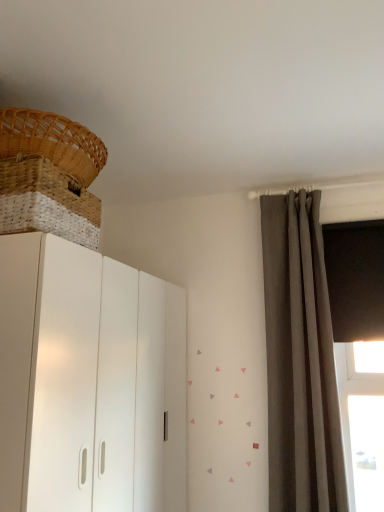
Question: Considering the positions of woven wood basket at upper left, positioned as the 1th basket in top-to-bottom order, and matte gray curtain at right in the image, is woven wood basket at upper left, positioned as the 1th basket in top-to-bottom order, bigger or smaller than matte gray curtain at right?

Choices:
 (A) small
 (B) big

Answer: (A)

Question: From a real-world perspective, is woven wood basket at upper left, positioned as the 1th basket in top-to-bottom order, above or below matte gray curtain at right?

Choices:
 (A) above
 (B) below

Answer: (A)

Question: Which object is positioned farthest from the white matte cupboard at left?

Choices:
 (A) matte gray curtain at right
 (B) woven wood basket at upper left, positioned as the 1th basket in top-to-bottom order
 (C) woven wood basket at upper left, the 2th basket from the top

Answer: (A)

Question: Which object is the closest to the woven wood basket at upper left, marked as the second basket in a bottom-to-top arrangement?

Choices:
 (A) woven wood basket at upper left, which is the first basket in bottom-to-top order
 (B) white matte cupboard at left
 (C) matte gray curtain at right

Answer: (A)